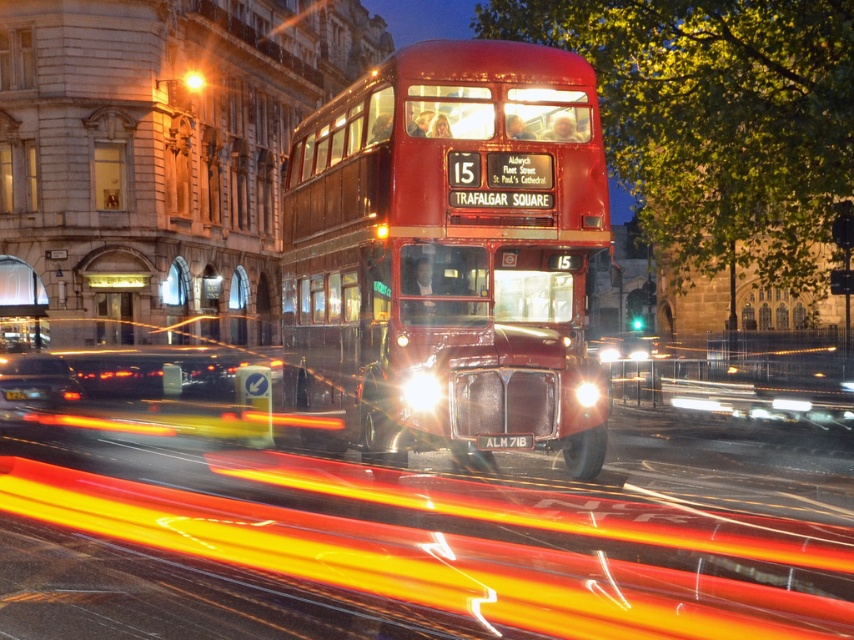
You are standing on the sidewalk and want to cross the street to reach the shiny red bus at center. The crosswalk is 12 meters away from your current position. Can you safely reach the bus before the crosswalk ends?

The shiny red bus at center is 11.58 meters away from you, which is less than the 12 meters length of the crosswalk. Therefore, you can safely reach the shiny red bus at center before the crosswalk ends.

You are a photographer planning to capture the shiny red bus at center and the shiny black sedan at lower left in a single frame. Based on their sizes in the image, which vehicle should you focus on to ensure both fit comfortably within the frame?

The shiny red bus at center is shorter than the shiny black sedan at lower left, so focusing on the shiny black sedan at lower left would allow both vehicles to fit comfortably within the frame since it occupies more vertical space.

You are a pedestrian standing at the side of the road looking at the shiny red bus at center and the black plastic license plate at center. Which object is closer to the left side of the road?

The black plastic license plate at center is closer to the left side of the road because the shiny red bus at center is to the right of it.